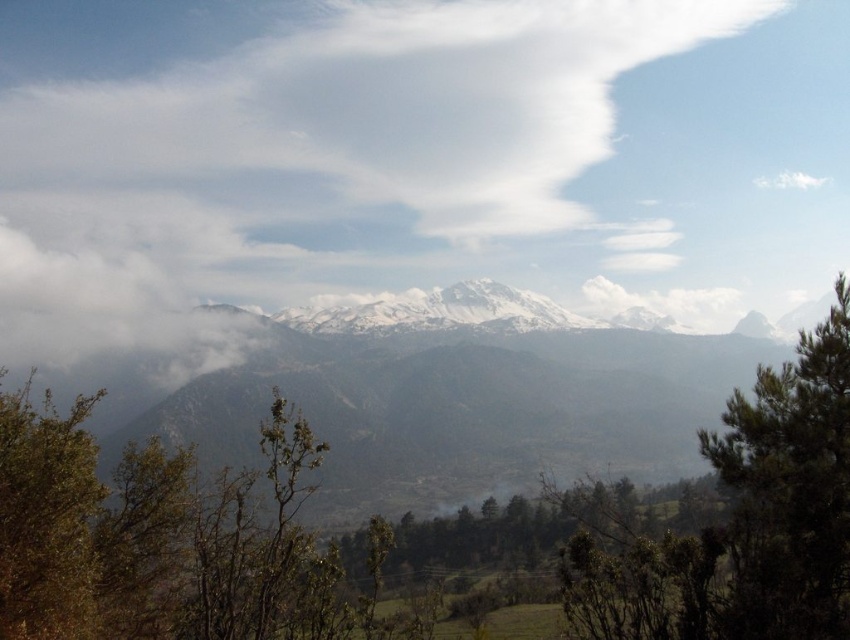
Question: Can you confirm if white fluffy cloud at upper center is positioned below green leafy tree at lower left?

Choices:
 (A) yes
 (B) no

Answer: (B)

Question: Which of these objects is positioned closest to the green leafy tree at right?

Choices:
 (A) green leafy tree at lower left
 (B) white snow-covered peak at upper center

Answer: (A)

Question: Which object appears farthest from the camera in this image?

Choices:
 (A) white snow-covered peak at upper center
 (B) green leafy tree at lower left

Answer: (A)

Question: Does snowy rock mountain range at center have a larger size compared to white snow-covered peak at upper center?

Choices:
 (A) no
 (B) yes

Answer: (B)

Question: Which object appears farthest from the camera in this image?

Choices:
 (A) green leafy tree at right
 (B) white fluffy cloud at upper center
 (C) white snow-covered peak at upper center

Answer: (C)

Question: Considering the relative positions of white fluffy cloud at upper center and white snow-covered peak at upper center in the image provided, where is white fluffy cloud at upper center located with respect to white snow-covered peak at upper center?

Choices:
 (A) above
 (B) below

Answer: (A)